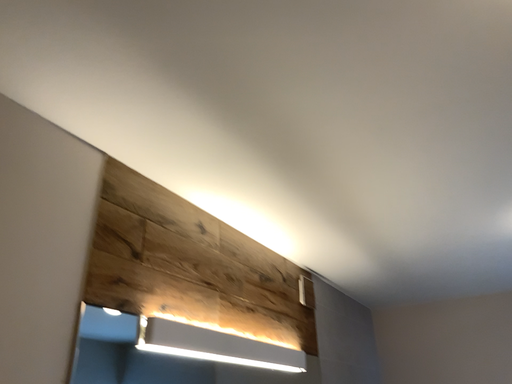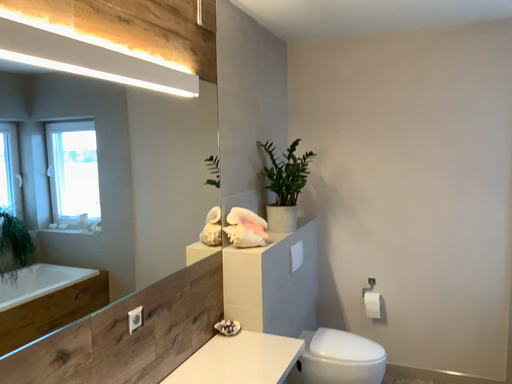
Question: Which way did the camera rotate in the video?

Choices:
 (A) rotated left
 (B) rotated right

Answer: (B)